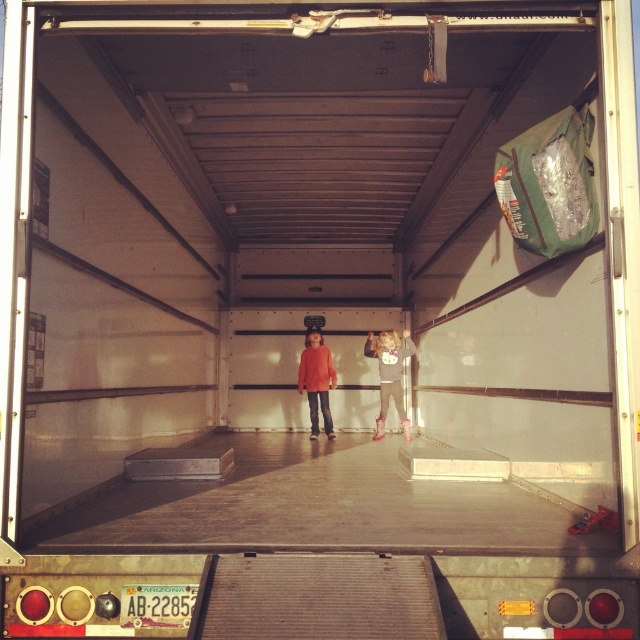
Is point (384, 394) farther from camera compared to point (324, 387)?

No, (384, 394) is in front of (324, 387).

Who is more forward, (378,352) or (330,362)?

Positioned in front is point (378,352).

The image size is (640, 640). Identify the location of matte gray sweater at center. (388, 374).